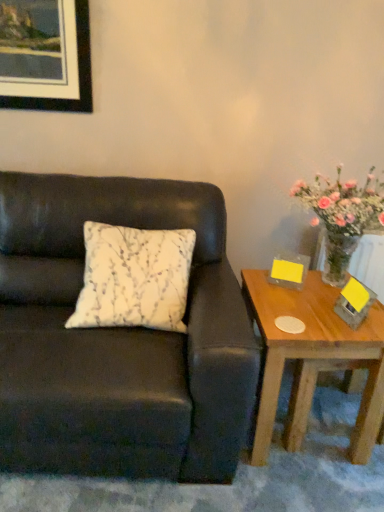
Where is `white printed cushion at center`? The height and width of the screenshot is (512, 384). white printed cushion at center is located at coordinates (134, 278).

Locate an element on the screen. matte black couch at left is located at coordinates (118, 340).

Locate an element on the screen. This screenshot has width=384, height=512. matte black picture frame at upper left is located at coordinates (45, 55).

There is a wooden table at right. Where is `picture frame above it (from a real-world perspective)`? The height and width of the screenshot is (512, 384). picture frame above it (from a real-world perspective) is located at coordinates (45, 55).

Is point (12, 19) positioned before point (310, 393)?

No, it is behind (310, 393).

Is matte black picture frame at upper left to the right of wooden table at right from the viewer's perspective?

Incorrect, matte black picture frame at upper left is not on the right side of wooden table at right.

From the image's perspective, is matte black picture frame at upper left above or below wooden table at right?

From the image's perspective, matte black picture frame at upper left appears above wooden table at right.

Is wooden table at right facing away from white printed cushion at center?

No, wooden table at right is not facing away from white printed cushion at center.

Considering the relative positions of wooden table at right and white printed cushion at center in the image provided, is wooden table at right to the left or to the right of white printed cushion at center?

From the image, it's evident that wooden table at right is to the right of white printed cushion at center.

Is wooden table at right positioned in front of white printed cushion at center?

No, wooden table at right is behind white printed cushion at center.

Between wooden table at right and white printed cushion at center, which one has smaller width?

Thinner between the two is white printed cushion at center.

From a real-world perspective, is matte black couch at left physically located above or below wooden table at right?

matte black couch at left is situated higher than wooden table at right in the real world.

How different are the orientations of matte black couch at left and wooden table at right in degrees?

The angle between the facing direction of matte black couch at left and the facing direction of wooden table at right is 2.48 degrees.

Does matte black couch at left contain wooden table at right?

No, wooden table at right is not inside matte black couch at left.

From the image's perspective, who appears lower, matte black couch at left or wooden table at right?

wooden table at right, from the image's perspective.

Is matte black picture frame at upper left located within matte black couch at left?

No.

How distant is matte black couch at left from matte black picture frame at upper left?

A distance of 32.18 inches exists between matte black couch at left and matte black picture frame at upper left.

Is matte black couch at left far away from matte black picture frame at upper left?

matte black couch at left is actually quite close to matte black picture frame at upper left.

Which of these two, matte black couch at left or matte black picture frame at upper left, is wider?

With larger width is matte black couch at left.

Is matte black couch at left positioned with its back to white printed cushion at center?

Yes, white printed cushion at center is at the back of matte black couch at left.

From the image's perspective, is matte black couch at left on white printed cushion at center?

Incorrect, from the image's perspective, matte black couch at left is lower than white printed cushion at center.

Does matte black couch at left have a lesser width compared to white printed cushion at center?

Incorrect, the width of matte black couch at left is not less than that of white printed cushion at center.

From their relative heights in the image, would you say matte black couch at left is taller or shorter than white printed cushion at center?

In the image, matte black couch at left appears to be taller than white printed cushion at center.

Is matte black picture frame at upper left smaller than matte black couch at left?

Indeed, matte black picture frame at upper left has a smaller size compared to matte black couch at left.

Is matte black picture frame at upper left shorter than matte black couch at left?

Yes.

From a real-world perspective, is matte black picture frame at upper left on matte black couch at left?

Yes, from a real-world perspective, matte black picture frame at upper left is on top of matte black couch at left.

Which object is closer to the camera, matte black picture frame at upper left or matte black couch at left?

matte black couch at left is more forward.

Is white printed cushion at center not close to matte black picture frame at upper left?

No, white printed cushion at center is not far away from matte black picture frame at upper left.

From a real-world perspective, which object rests below the other?

white printed cushion at center.

Is white printed cushion at center aimed at matte black picture frame at upper left?

No, white printed cushion at center is not oriented towards matte black picture frame at upper left.

Locate an element on the screen. This screenshot has width=384, height=512. coffee table lying on the right of matte black picture frame at upper left is located at coordinates (313, 359).

At what (x,y) coordinates should I click in order to perform the action: click on coffee table below the white printed cushion at center (from a real-world perspective). Please return your answer as a coordinate pair (x, y). Looking at the image, I should click on (313, 359).

In the scene shown: When comparing their distances from white printed cushion at center, does matte black picture frame at upper left or wooden table at right seem closer?

The object closer to white printed cushion at center is wooden table at right.

Based on their spatial positions, is white printed cushion at center or matte black picture frame at upper left further from wooden table at right?

The object further to wooden table at right is matte black picture frame at upper left.

Looking at the image, which one is located further to white printed cushion at center, matte black couch at left or wooden table at right?

wooden table at right is further to white printed cushion at center.

Based on their spatial positions, is matte black picture frame at upper left or matte black couch at left further from white printed cushion at center?

The object further to white printed cushion at center is matte black picture frame at upper left.

Considering their positions, is wooden table at right positioned further to matte black couch at left than matte black picture frame at upper left?

The object further to matte black couch at left is matte black picture frame at upper left.

Which object lies further to the anchor point white printed cushion at center, matte black couch at left or matte black picture frame at upper left?

Among the two, matte black picture frame at upper left is located further to white printed cushion at center.

Which object lies nearer to the anchor point wooden table at right, matte black picture frame at upper left or white printed cushion at center?

white printed cushion at center lies closer to wooden table at right than the other object.

Which object lies nearer to the anchor point matte black picture frame at upper left, white printed cushion at center or wooden table at right?

The object closer to matte black picture frame at upper left is white printed cushion at center.

At what (x,y) coordinates should I click in order to perform the action: click on pillow that lies between matte black picture frame at upper left and matte black couch at left from top to bottom. Please return your answer as a coordinate pair (x, y). Image resolution: width=384 pixels, height=512 pixels. Looking at the image, I should click on (134, 278).

You are a GUI agent. You are given a task and a screenshot of the screen. Output one action in this format:
    pyautogui.click(x=<x>, y=<y>)
    Task: Click on the pillow between matte black couch at left and wooden table at right from left to right
    This screenshot has height=512, width=384.
    Given the screenshot: What is the action you would take?
    pyautogui.click(x=134, y=278)

You are a GUI agent. You are given a task and a screenshot of the screen. Output one action in this format:
    pyautogui.click(x=<x>, y=<y>)
    Task: Click on the studio couch between matte black picture frame at upper left and wooden table at right in the vertical direction
    The height and width of the screenshot is (512, 384).
    Given the screenshot: What is the action you would take?
    pyautogui.click(x=118, y=340)

I want to click on pillow between matte black picture frame at upper left and wooden table at right vertically, so click(134, 278).